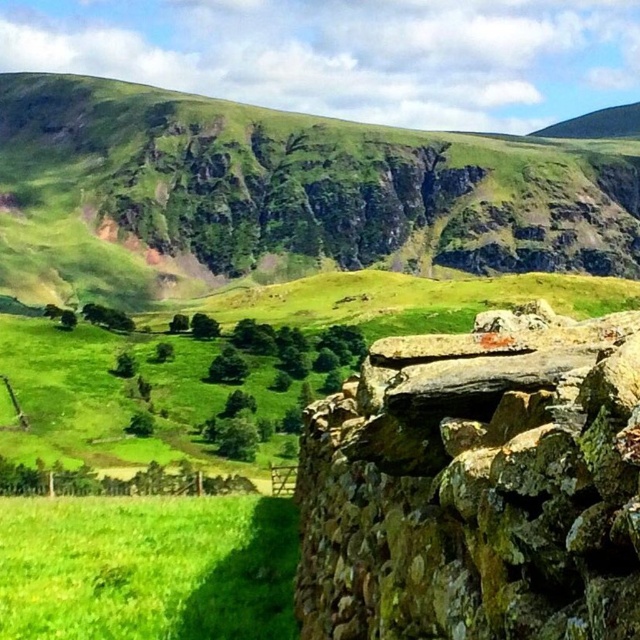
Based on the photo, you are a hiker standing at the base of the stone wall in the foreground. You want to reach the green grassy hillside at upper center. Given that your average walking pace is 1.5 meters per second, how many minutes will it take you to reach the hillside?

The distance between you and the green grassy hillside at upper center is 199.92 meters. At a pace of 1.5 meters per second, it would take approximately 133.28 seconds, which is roughly 2.22 minutes. Therefore, it will take about 2.22 minutes to reach the hillside.

You are a hiker who wants to climb the highest point in the image. Which object should you choose between the green grassy hillside at upper center and the rusty stone cliff at right?

The green grassy hillside at upper center is much taller than the rusty stone cliff at right, so you should choose the green grassy hillside at upper center to climb the highest point.

You are a hiker planning to cross the area shown in the image. You need to choose between two paths leading to the green grassy hillside at upper center and the green grassy field at lower left. Which path would require walking a greater distance due to the size of the terrain?

The green grassy hillside at upper center has a larger size compared to the green grassy field at lower left, so the path to the green grassy hillside at upper center would require walking a greater distance due to its larger size.